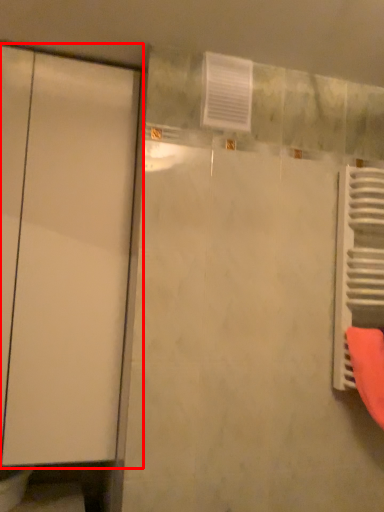
Question: Where is door (annotated by the red box) located in relation to radiator in the image?

Choices:
 (A) left
 (B) right

Answer: (A)